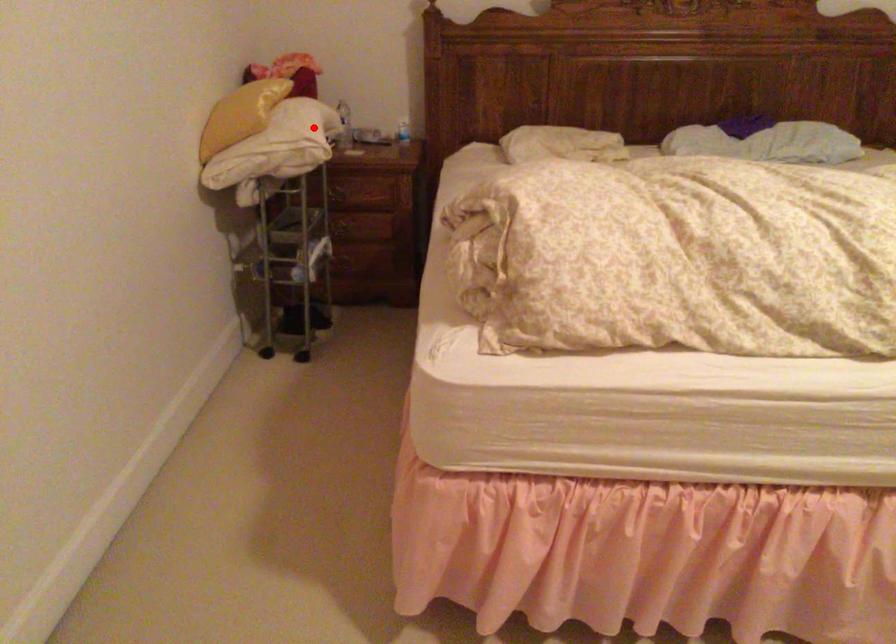
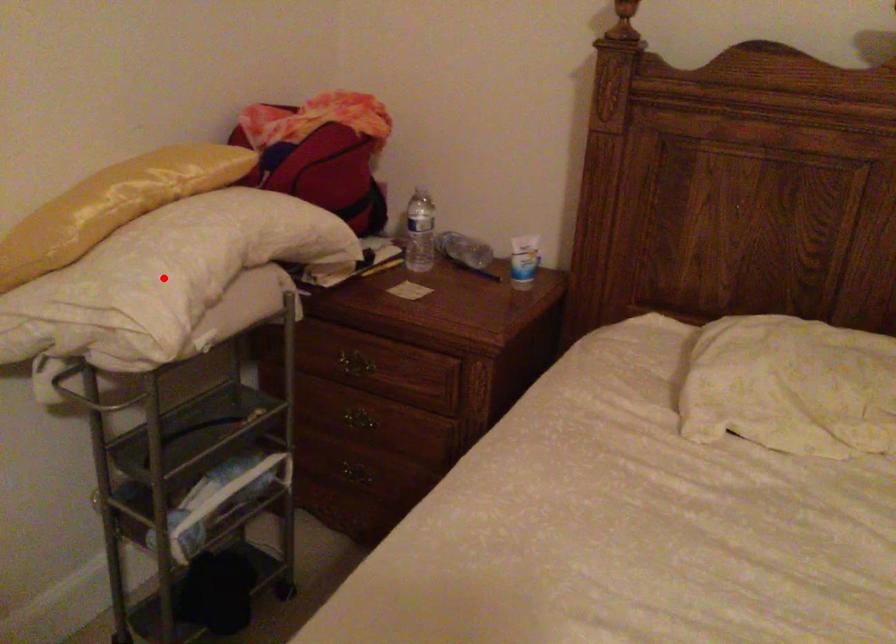
I am providing you with two images of the same scene from different viewpoints. A red point is marked on the first image and another point is marked on the second image. Do the highlighted points in image1 and image2 indicate the same real-world spot?

Yes